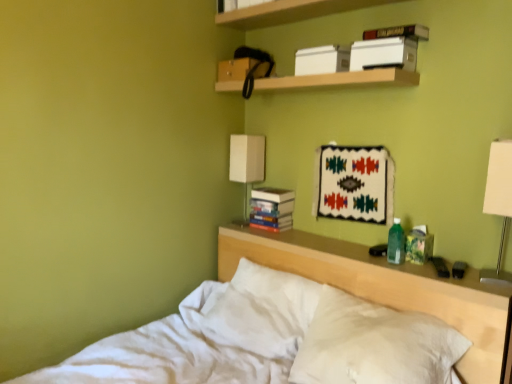
Question: Which direction should I rotate to look at hardcover book at upper center, positioned as the second paperback book in left-to-right order?

Choices:
 (A) right
 (B) left

Answer: (A)

Question: Can you confirm if hardcover books at center, which appears as the third paperback book when viewed from the right, is shorter than hardcover book at upper center, acting as the second paperback book starting from the front?

Choices:
 (A) no
 (B) yes

Answer: (A)

Question: Can you confirm if hardcover books at center, the third paperback book in the front-to-back sequence, is taller than hardcover book at upper center, marked as the third paperback book in a bottom-to-top arrangement?

Choices:
 (A) no
 (B) yes

Answer: (B)

Question: From the image's perspective, is hardcover books at center, the first paperback book viewed from the left, located beneath hardcover book at upper center, acting as the second paperback book starting from the front?

Choices:
 (A) yes
 (B) no

Answer: (A)

Question: Considering the relative sizes of hardcover books at center, the 1th paperback book positioned from the back, and hardcover book at upper center, positioned as the 2th paperback book in back-to-front order, in the image provided, is hardcover books at center, the 1th paperback book positioned from the back, thinner than hardcover book at upper center, positioned as the 2th paperback book in back-to-front order,?

Choices:
 (A) no
 (B) yes

Answer: (B)

Question: From the image's perspective, does hardcover books at center, the first paperback book in the bottom-to-top sequence, appear higher than hardcover book at upper center, marked as the third paperback book in a bottom-to-top arrangement?

Choices:
 (A) yes
 (B) no

Answer: (B)

Question: Is hardcover books at center, which appears as the third paperback book when viewed from the right, positioned behind hardcover book at upper center, positioned as the 2th paperback book in back-to-front order?

Choices:
 (A) no
 (B) yes

Answer: (B)

Question: Can you confirm if wooden shelf at upper center, which is the 2th shelf from bottom to top, is positioned to the left of white soft pillow at center?

Choices:
 (A) yes
 (B) no

Answer: (A)

Question: Can you confirm if wooden shelf at upper center, which is the 2th shelf from bottom to top, is positioned to the right of white soft pillow at center?

Choices:
 (A) yes
 (B) no

Answer: (B)

Question: Is wooden shelf at upper center, which is the 2th shelf from bottom to top, thinner than white soft pillow at center?

Choices:
 (A) yes
 (B) no

Answer: (A)

Question: Is wooden shelf at upper center, the first shelf when ordered from top to bottom, oriented towards white soft pillow at center?

Choices:
 (A) no
 (B) yes

Answer: (A)

Question: From a real-world perspective, is wooden shelf at upper center, which is the 2th shelf from bottom to top, physically below white soft pillow at center?

Choices:
 (A) no
 (B) yes

Answer: (A)

Question: From the image's perspective, is wooden shelf at upper center, which is the 2th shelf from bottom to top, on top of white soft pillow at center?

Choices:
 (A) yes
 (B) no

Answer: (A)

Question: Is wooden shelf at upper center, the first shelf when ordered from top to bottom, surrounding white cotton bed at center?

Choices:
 (A) yes
 (B) no

Answer: (B)